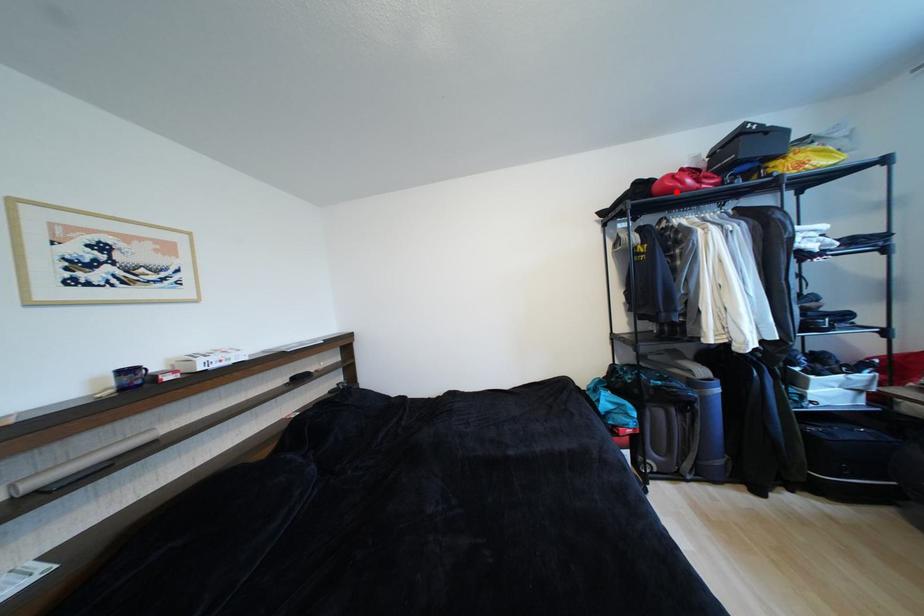
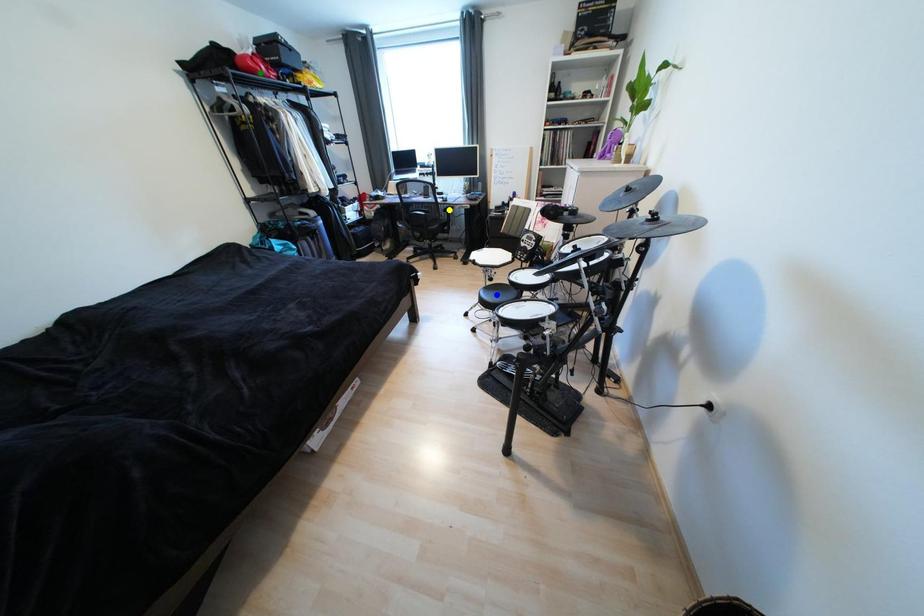
Question: I am providing you with two images of the same scene from different viewpoints. A red point is marked on the first image. You are given multiple points on the second image. In image 2, which mark is for the same physical point as the one in image 1?

Choices:
 (A) yellow point
 (B) blue point
 (C) green point

Answer: (C)